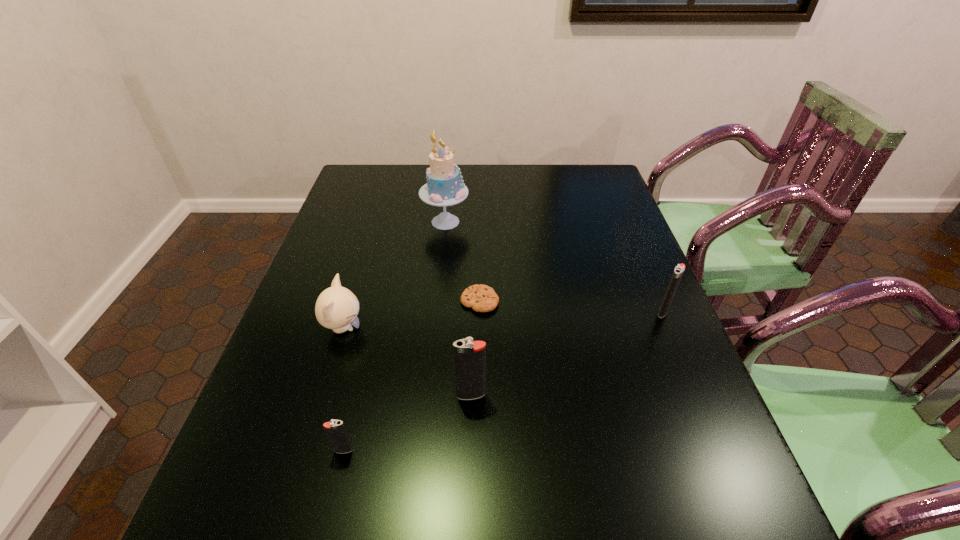
Please point a space for a new igniter to maintain equal intervals. Please provide its 2D coordinates. Your answer should be formatted as a tuple, i.e. [(x, y)], where the tuple contains the x and y coordinates of a point satisfying the conditions above.

[(576, 349)]